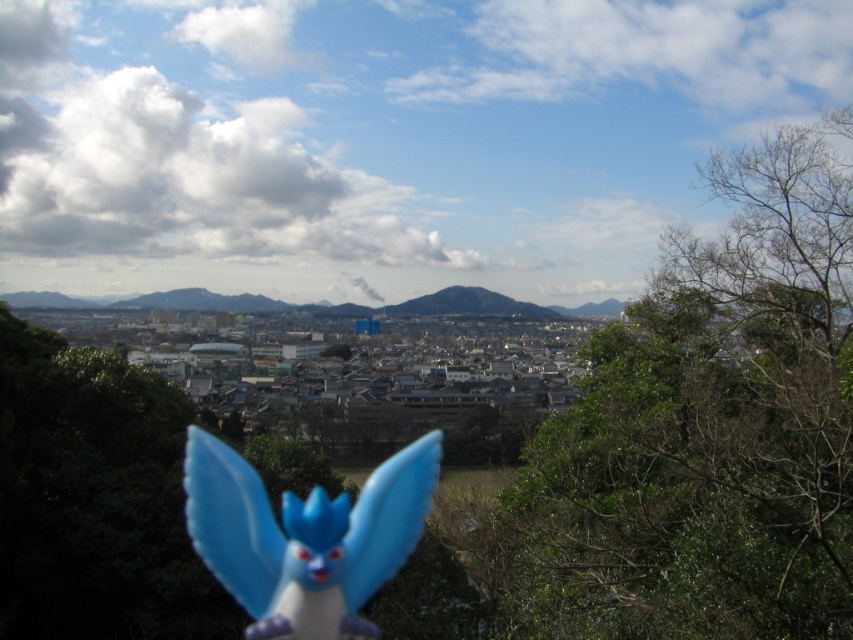
You are a bird flying over the cityscape. You see the green leafy tree at center right and the blue plastic toy at center. Which object is higher from the ground?

The green leafy tree at center right is above the blue plastic toy at center, so the green leafy tree at center right is higher from the ground.

You are a drone operator trying to capture a photo of the green leafy tree at center right from above. The camera is currently positioned directly above the small blue figurine in the lower center. To frame the tree properly, in which cardinal direction should you move the camera relative to the figurine?

The green leafy tree at center right is located at coordinates 0.670 in the x axis and 0.831 in the y axis. Since the camera is above the figurine at lower center, moving it northeast would align it with the tree.

You are a child who found both the green leafy tree at center right and the blue plastic toy at center. Which object is larger in size?

The green leafy tree at center right is bigger than the blue plastic toy at center, so the green leafy tree at center right is larger in size.